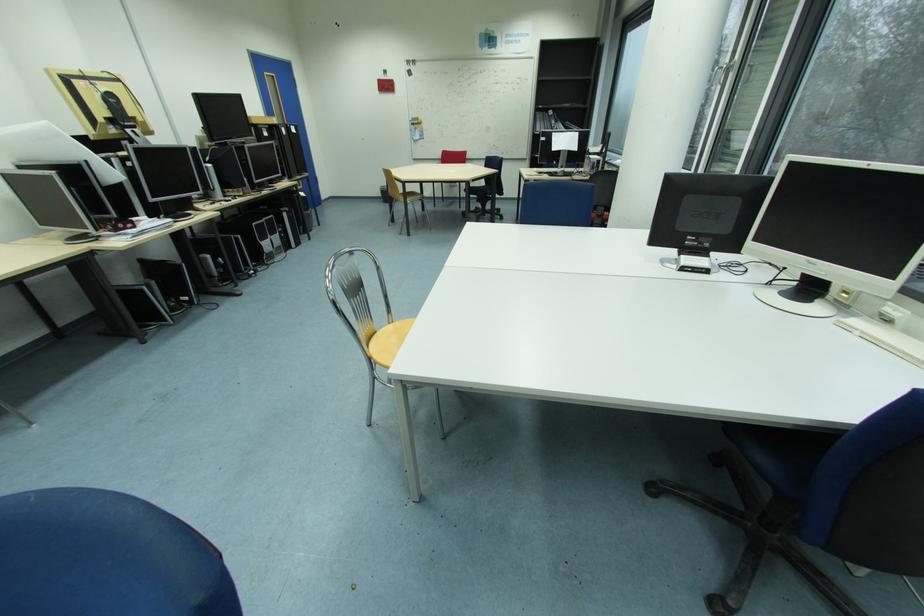
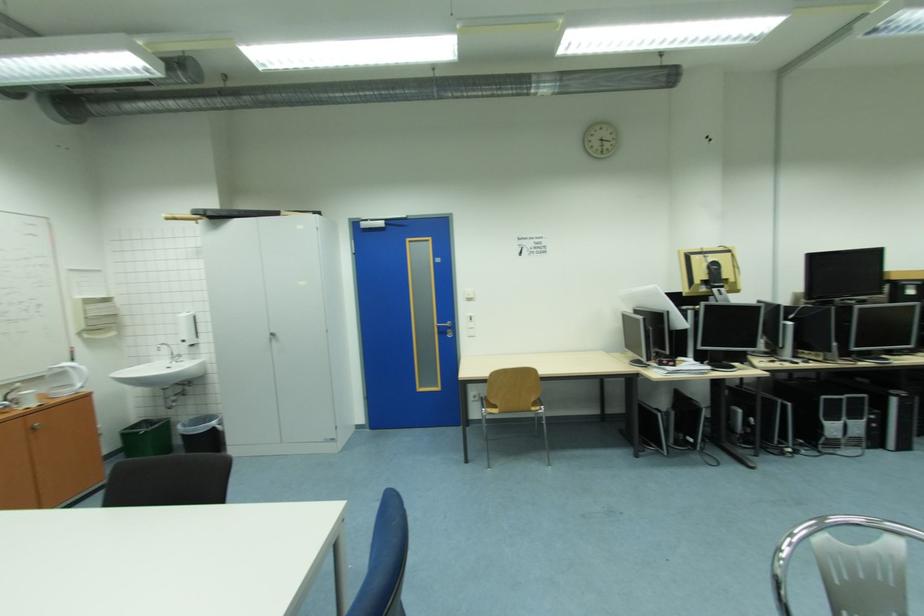
Where in the second image is the point corresponding to point (293, 215) from the first image?

(901, 400)